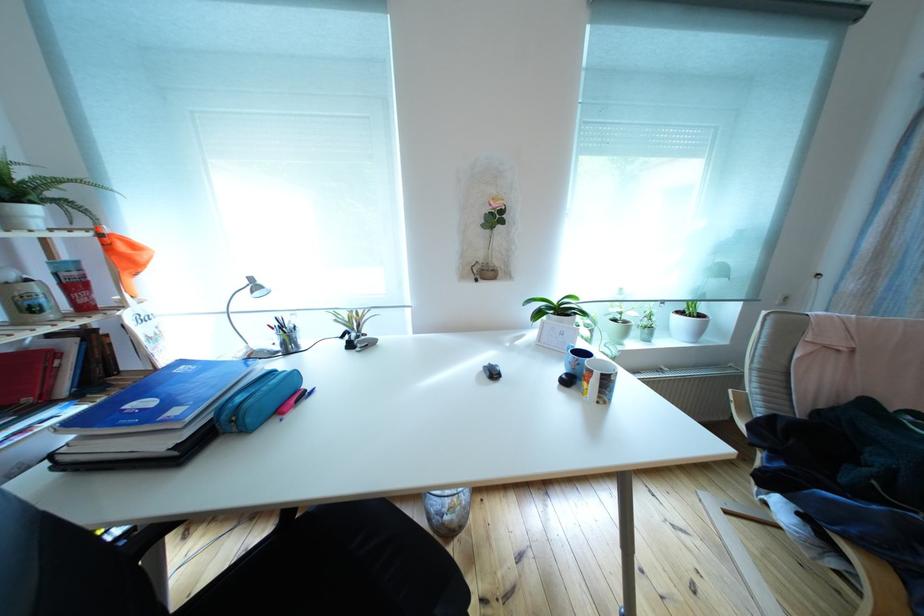
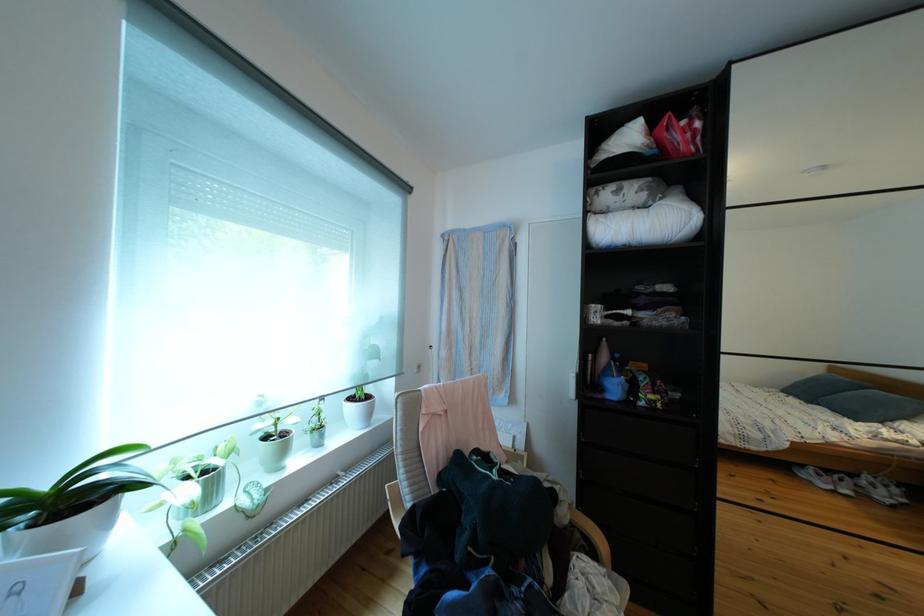
Where in the second image is the point corresponding to the point at 566,308 from the first image?

(55, 492)